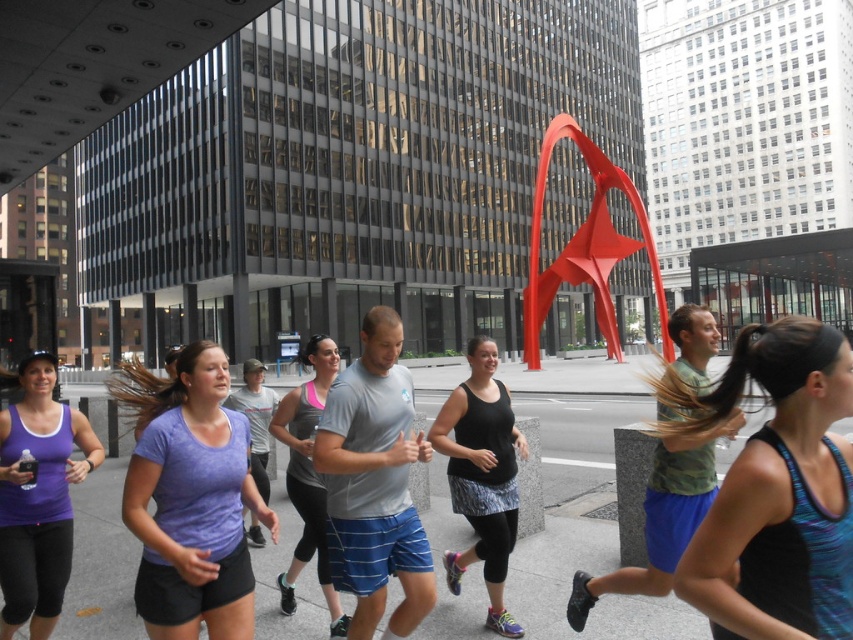
Does point (747, 492) lie behind point (62, 518)?

No.

Does matte black tank top at center appear under purple matte tank top at lower left?

No.

Is point (683, 424) positioned after point (49, 602)?

That is False.

Identify the location of matte black tank top at center. This screenshot has height=640, width=853. (775, 490).

Is camouflage fabric shirt at center thinner than matte gray tank top at center?

Indeed, camouflage fabric shirt at center has a lesser width compared to matte gray tank top at center.

Is point (686, 497) closer to camera compared to point (294, 474)?

Yes.

You are a GUI agent. You are given a task and a screenshot of the screen. Output one action in this format:
    pyautogui.click(x=<x>, y=<y>)
    Task: Click on the camouflage fabric shirt at center
    
    Given the screenshot: What is the action you would take?
    click(660, 518)

Between point (54, 536) and point (318, 509), which one is positioned in front?

Point (54, 536)

Consider the image. Between purple matte tank top at lower left and matte gray tank top at center, which one is positioned lower?

matte gray tank top at center is below.

Is point (36, 416) positioned behind point (299, 509)?

No, it is in front of (299, 509).

Locate an element on the screen. The image size is (853, 640). purple matte tank top at lower left is located at coordinates (38, 497).